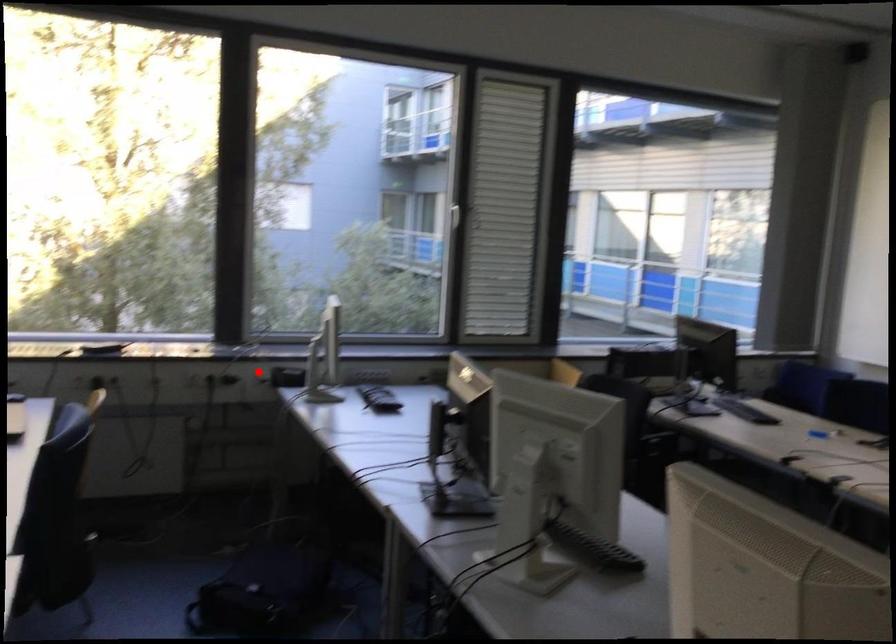
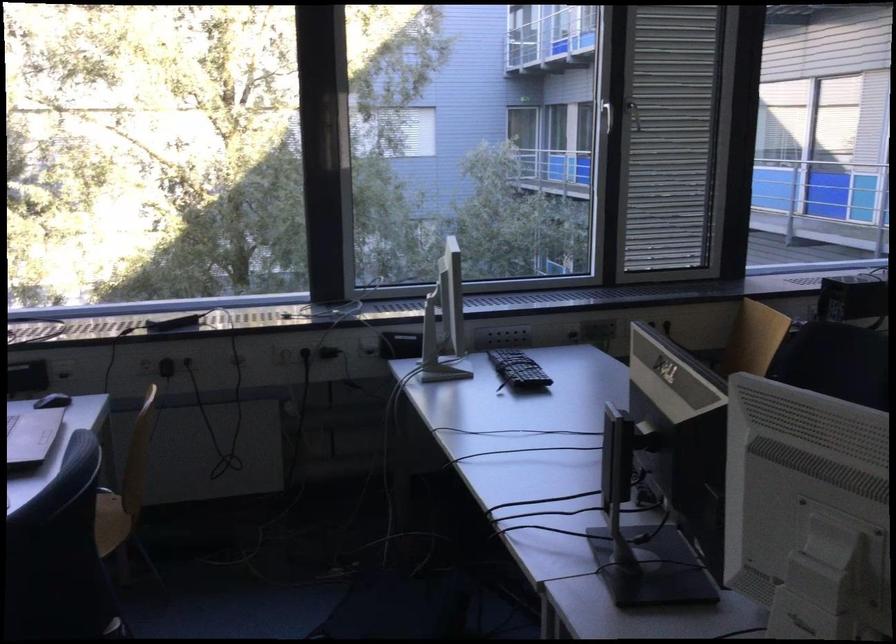
Question: I am providing you with two images of the same scene from different viewpoints. A red point is shown in image1. For the corresponding object point in image2, is it positioned nearer or farther from the camera?

Choices:
 (A) Nearer
 (B) Farther

Answer: (A)